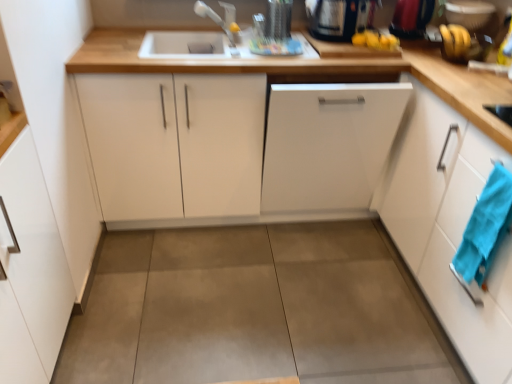
Find the location of a particular element. The width and height of the screenshot is (512, 384). free space in front of matte silver faucet at upper center is located at coordinates (211, 51).